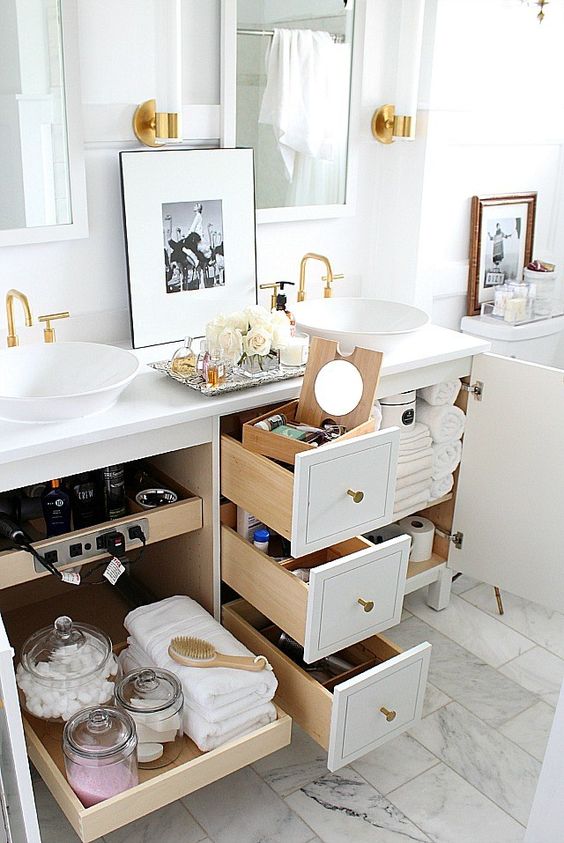
You are a GUI agent. You are given a task and a screenshot of the screen. Output one action in this format:
    pyautogui.click(x=<x>, y=<y>)
    Task: Click on the sink basin
    
    Given the screenshot: What is the action you would take?
    pyautogui.click(x=37, y=371), pyautogui.click(x=362, y=314)